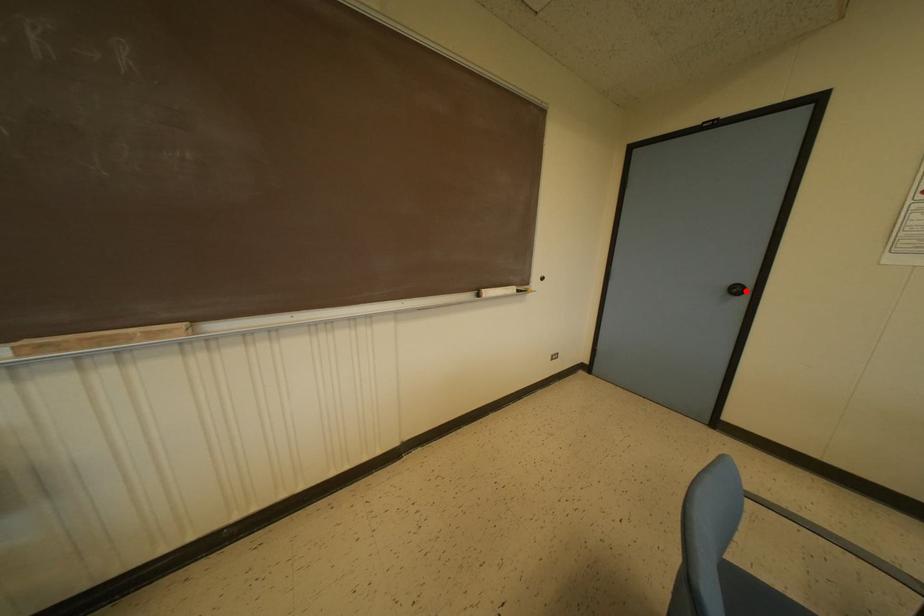
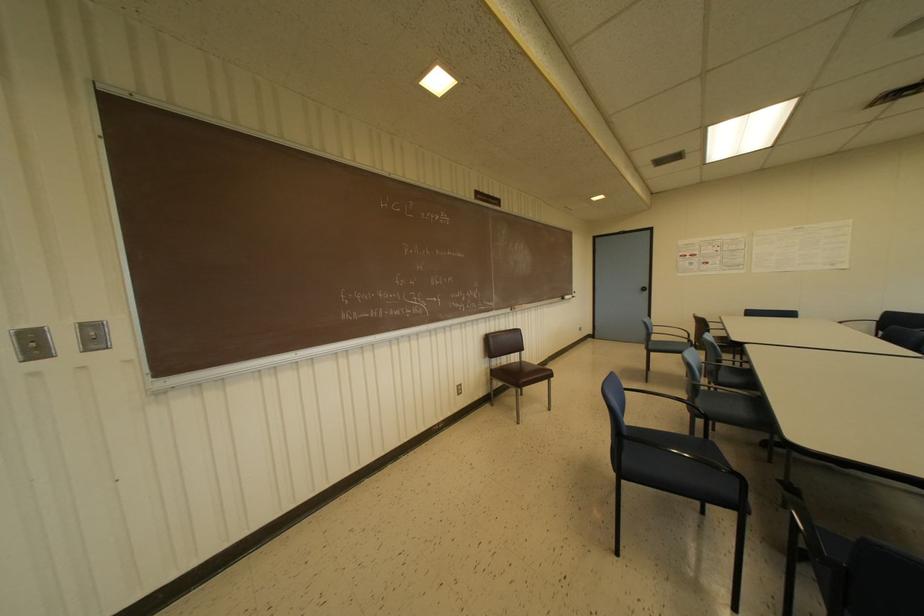
The point at the highlighted location is marked in the first image. Where is the corresponding point in the second image?

(646, 288)